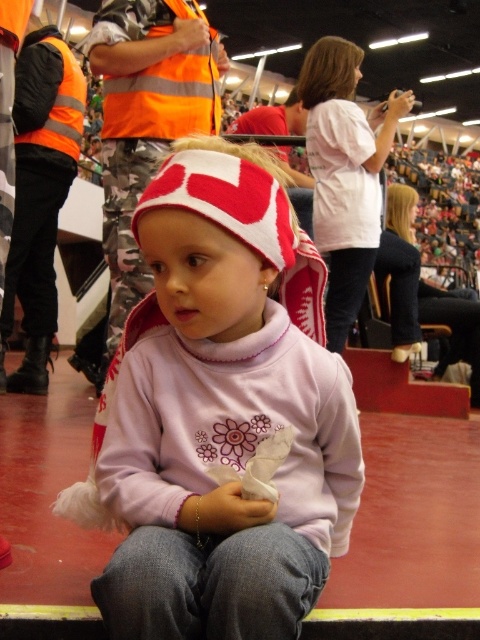
Does matte pink sweater at center appear under matte white shirt at center?

Indeed, matte pink sweater at center is positioned under matte white shirt at center.

The height and width of the screenshot is (640, 480). In order to click on matte pink sweater at center in this screenshot , I will do `click(224, 413)`.